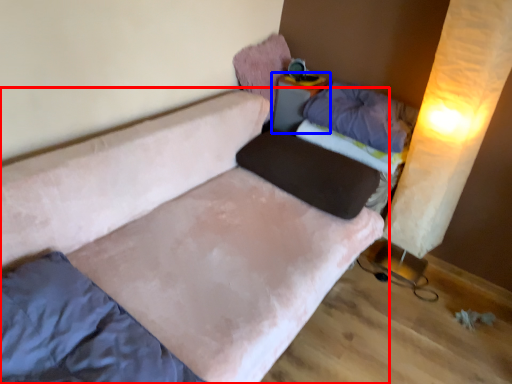
Question: Which point is further to the camera, studio couch (highlighted by a red box) or table (highlighted by a blue box)?

Choices:
 (A) studio couch
 (B) table

Answer: (B)